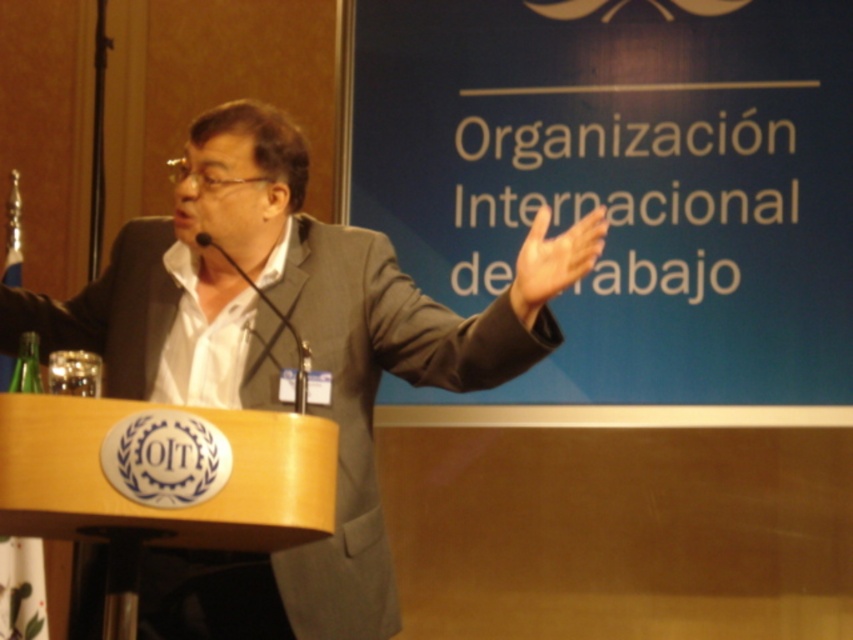
Is wooden podium at center positioned before white matte hand at upper center?

Yes, it is in front of white matte hand at upper center.

Does wooden podium at center appear on the left side of white matte hand at upper center?

Indeed, wooden podium at center is positioned on the left side of white matte hand at upper center.

Where is `wooden podium at center`? wooden podium at center is located at coordinates (160, 508).

Can you confirm if gray suit at center is taller than wooden podium at center?

Yes.

Locate an element on the screen. gray suit at center is located at coordinates (270, 364).

Between gray suit at center and white matte hand at upper center, which one has less height?

white matte hand at upper center

Can you confirm if gray suit at center is positioned below white matte hand at upper center?

Correct, gray suit at center is located below white matte hand at upper center.

Which is behind, point (218, 600) or point (573, 275)?

The point (218, 600) is behind.

Where is `gray suit at center`? gray suit at center is located at coordinates (270, 364).